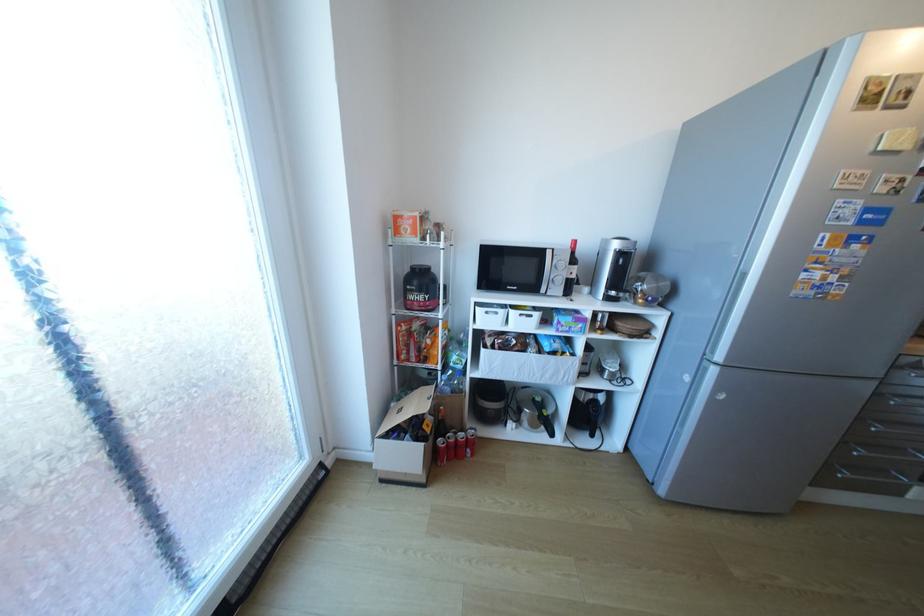
Locate an element on the screen. Image resolution: width=924 pixels, height=616 pixels. red wine bottle is located at coordinates (554, 535).